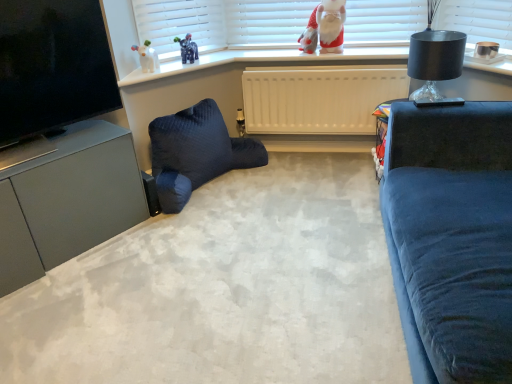
Where is `free point below dark blue quilted bean bag chair at lower left (from a real-world perspective)`? The width and height of the screenshot is (512, 384). free point below dark blue quilted bean bag chair at lower left (from a real-world perspective) is located at coordinates (217, 183).